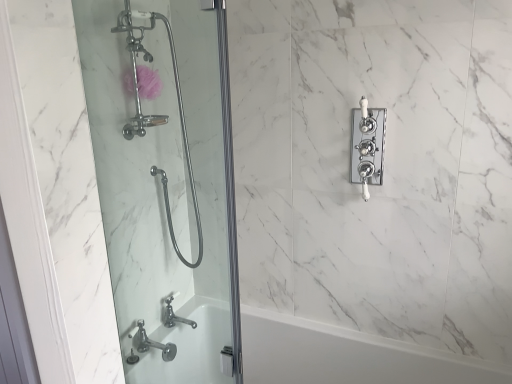
Question: Should I look upward or downward to see white glossy bathtub at lower left?

Choices:
 (A) up
 (B) down

Answer: (B)

Question: Is white glossy bathtub at lower left at the back of clear glass shower door at left?

Choices:
 (A) no
 (B) yes

Answer: (A)

Question: Considering the relative sizes of clear glass shower door at left and white glossy bathtub at lower left in the image provided, is clear glass shower door at left bigger than white glossy bathtub at lower left?

Choices:
 (A) yes
 (B) no

Answer: (B)

Question: From a real-world perspective, is clear glass shower door at left physically above white glossy bathtub at lower left?

Choices:
 (A) no
 (B) yes

Answer: (B)

Question: Is clear glass shower door at left at the left side of white glossy bathtub at lower left?

Choices:
 (A) yes
 (B) no

Answer: (A)

Question: Considering the relative sizes of clear glass shower door at left and white glossy bathtub at lower left in the image provided, is clear glass shower door at left thinner than white glossy bathtub at lower left?

Choices:
 (A) no
 (B) yes

Answer: (B)

Question: Does clear glass shower door at left have a greater height compared to white glossy bathtub at lower left?

Choices:
 (A) no
 (B) yes

Answer: (B)

Question: Considering the relative sizes of white glossy bathtub at lower left and pink sponge at upper left in the image provided, is white glossy bathtub at lower left bigger than pink sponge at upper left?

Choices:
 (A) yes
 (B) no

Answer: (A)

Question: Is the position of white glossy bathtub at lower left more distant than that of pink sponge at upper left?

Choices:
 (A) no
 (B) yes

Answer: (A)

Question: Considering the relative positions of white glossy bathtub at lower left and pink sponge at upper left in the image provided, is white glossy bathtub at lower left in front of pink sponge at upper left?

Choices:
 (A) no
 (B) yes

Answer: (B)

Question: Are white glossy bathtub at lower left and pink sponge at upper left beside each other?

Choices:
 (A) no
 (B) yes

Answer: (A)

Question: Considering the relative sizes of white glossy bathtub at lower left and pink sponge at upper left in the image provided, is white glossy bathtub at lower left wider than pink sponge at upper left?

Choices:
 (A) yes
 (B) no

Answer: (A)

Question: Would you say white glossy bathtub at lower left is outside pink sponge at upper left?

Choices:
 (A) yes
 (B) no

Answer: (A)

Question: Is white ceramic faucet at upper right bigger than white glossy bathtub at lower left?

Choices:
 (A) no
 (B) yes

Answer: (A)